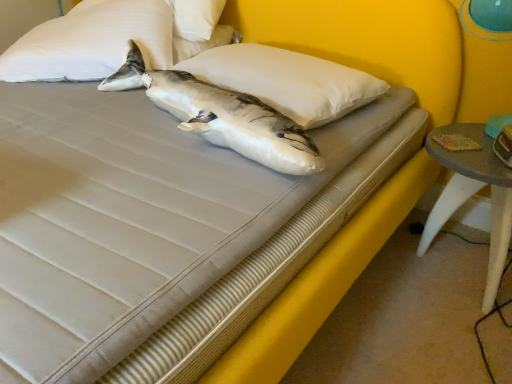
The width and height of the screenshot is (512, 384). Identify the location of vacant space underneath smooth gray table at lower right (from a real-world perspective). (456, 267).